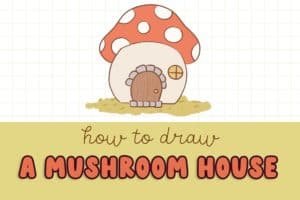
This screenshot has height=200, width=300. I want to click on window with yellow light coming from inside, so click(x=171, y=70).